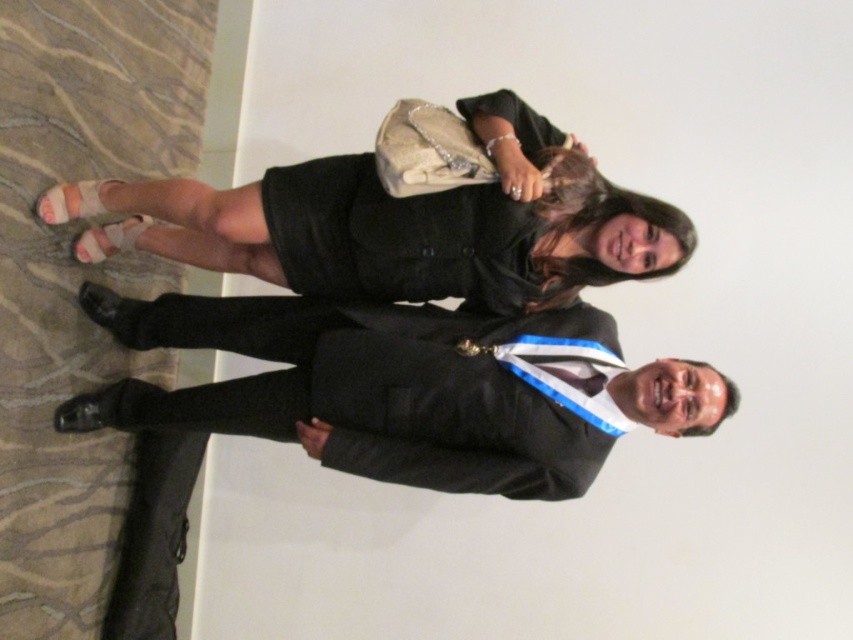
Does black fabric dress at upper center appear on the right side of black matte suit at center?

Correct, you'll find black fabric dress at upper center to the right of black matte suit at center.

What do you see at coordinates (401, 225) in the screenshot? I see `black fabric dress at upper center` at bounding box center [401, 225].

Where is `black fabric dress at upper center`? black fabric dress at upper center is located at coordinates (401, 225).